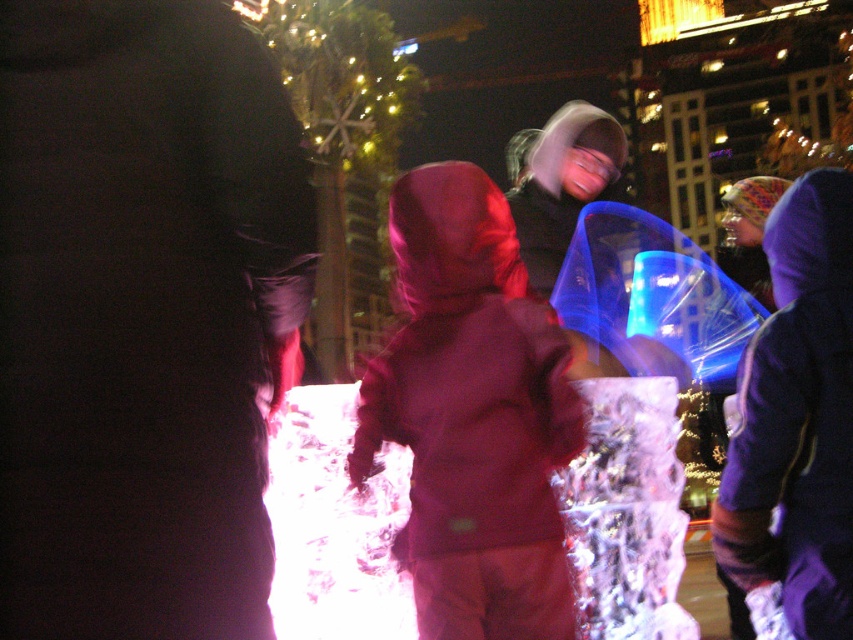
Is velvet-like maroon coat at center thinner than purple fleece jacket at right?

In fact, velvet-like maroon coat at center might be wider than purple fleece jacket at right.

Is velvet-like maroon coat at center taller than purple fleece jacket at right?

Correct, velvet-like maroon coat at center is much taller as purple fleece jacket at right.

Measure the distance between velvet-like maroon coat at center and camera.

velvet-like maroon coat at center is 6.79 meters from camera.

Image resolution: width=853 pixels, height=640 pixels. In order to click on velvet-like maroon coat at center in this screenshot , I will do point(473,413).

Between matte black jacket at center and velvet-like maroon coat at center, which one is positioned higher?

matte black jacket at center is higher up.

Between matte black jacket at center and velvet-like maroon coat at center, which one appears on the left side from the viewer's perspective?

matte black jacket at center

This screenshot has height=640, width=853. I want to click on matte black jacket at center, so click(140, 314).

Where is `matte black jacket at center`? matte black jacket at center is located at coordinates (140, 314).

Which is above, matte black jacket at center or purple fleece jacket at right?

Positioned higher is matte black jacket at center.

Between point (256, 298) and point (845, 397), which one is positioned behind?

Point (845, 397)

Does point (183, 504) come closer to viewer compared to point (795, 408)?

Yes, it is.

Locate an element on the screen. matte black jacket at center is located at coordinates (140, 314).